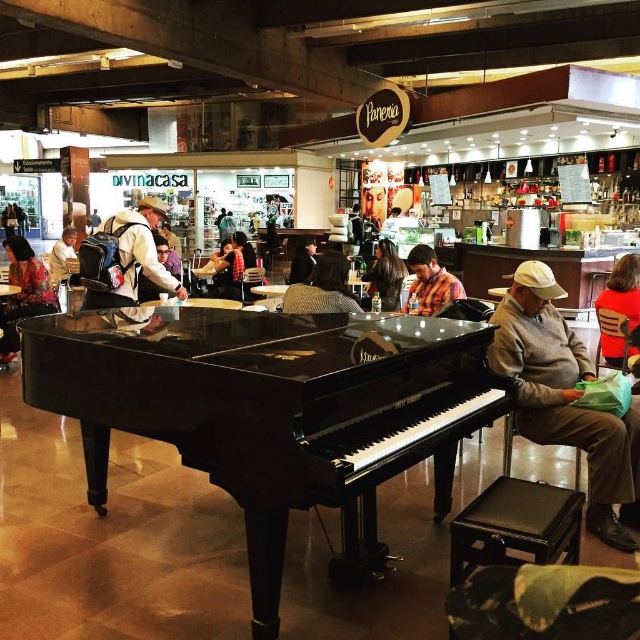
Question: Which of these objects is positioned farthest from the plaid shirt at center?

Choices:
 (A) black polished piano at center
 (B) orange fabric jacket at right
 (C) white backpack at center

Answer: (C)

Question: Is gray wool sweater at right to the left of striped fabric jacket at center from the viewer's perspective?

Choices:
 (A) no
 (B) yes

Answer: (A)

Question: From the image, what is the correct spatial relationship of plaid shirt at center in relation to dark brown hair at center?

Choices:
 (A) right
 (B) left

Answer: (A)

Question: Which point appears farthest from the camera in this image?

Choices:
 (A) (328, 266)
 (B) (449, 582)
 (C) (51, 266)
 (D) (563, 440)

Answer: (C)

Question: Can you confirm if striped fabric jacket at center is positioned to the left of plaid shirt at center?

Choices:
 (A) yes
 (B) no

Answer: (A)

Question: Among these points, which one is farthest from the camera?

Choices:
 (A) (506, 493)
 (B) (291, 304)
 (C) (618, 339)
 (D) (83, 422)

Answer: (C)